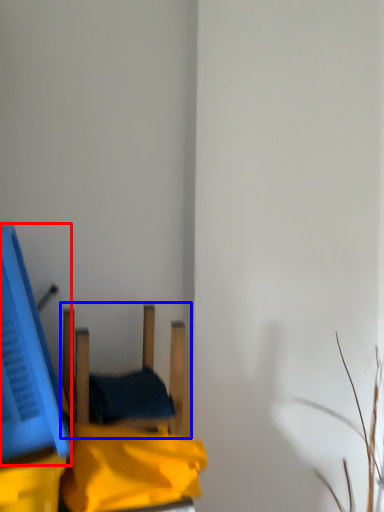
Question: Among these objects, which one is nearest to the camera, wide (highlighted by a red box) or furniture (highlighted by a blue box)?

Choices:
 (A) wide
 (B) furniture

Answer: (A)